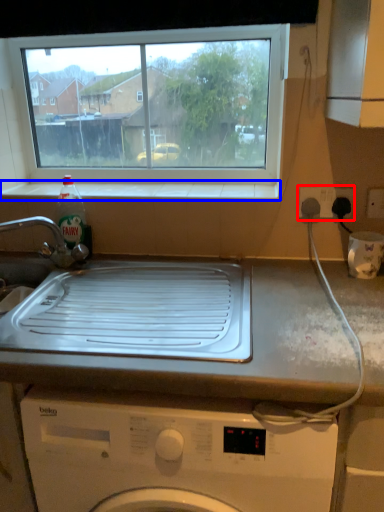
Question: Among these objects, which one is nearest to the camera, electric outlet (highlighted by a red box) or window sill (highlighted by a blue box)?

Choices:
 (A) electric outlet
 (B) window sill

Answer: (A)